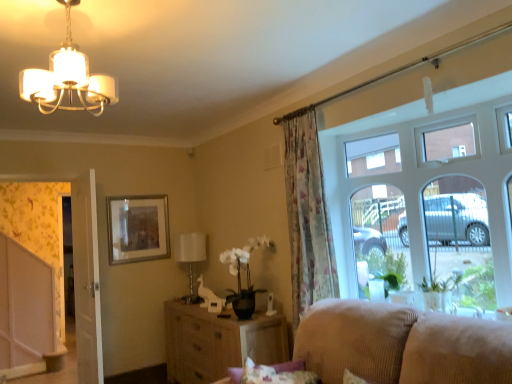
Locate an element on the screen. This screenshot has width=512, height=384. empty space that is ontop of white glossy screen door at left is located at coordinates (29, 167).